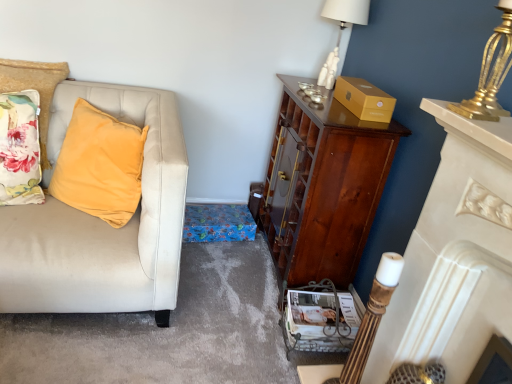
Question: Does gold metallic lamp at upper right, which is counted as the 1th lamp, starting from the front, have a lesser height compared to floral fabric pillow at left?

Choices:
 (A) no
 (B) yes

Answer: (B)

Question: Is floral fabric pillow at left located within gold metallic lamp at upper right, which appears as the 2th lamp when viewed from the top?

Choices:
 (A) yes
 (B) no

Answer: (B)

Question: Is gold metallic lamp at upper right, which is the first lamp in bottom-to-top order, to the left of floral fabric pillow at left from the viewer's perspective?

Choices:
 (A) no
 (B) yes

Answer: (A)

Question: Is gold metallic lamp at upper right, which is counted as the 1th lamp, starting from the right, in front of floral fabric pillow at left?

Choices:
 (A) yes
 (B) no

Answer: (A)

Question: Is gold metallic lamp at upper right, which is the first lamp in bottom-to-top order, wider than floral fabric pillow at left?

Choices:
 (A) no
 (B) yes

Answer: (A)

Question: Looking at their shapes, would you say gold metallic lamp at upper right, placed as the 2th lamp when sorted from left to right, is wider or thinner than white ceramic lamp at upper right, the 2th lamp from the right?

Choices:
 (A) thin
 (B) wide

Answer: (A)

Question: From the image's perspective, is gold metallic lamp at upper right, which is counted as the 1th lamp, starting from the front, located above or below white ceramic lamp at upper right, the second lamp positioned from the bottom?

Choices:
 (A) below
 (B) above

Answer: (A)

Question: Based on their positions, is gold metallic lamp at upper right, which is counted as the 1th lamp, starting from the right, located to the left or right of white ceramic lamp at upper right, which is the 1th lamp from back to front?

Choices:
 (A) right
 (B) left

Answer: (A)

Question: Is gold metallic lamp at upper right, placed as the 2th lamp when sorted from left to right, taller or shorter than white ceramic lamp at upper right, the 2th lamp from the right?

Choices:
 (A) short
 (B) tall

Answer: (A)

Question: From the image's perspective, is white ceramic lamp at upper right, which is the first lamp in left-to-right order, positioned above or below floral fabric pillow at left?

Choices:
 (A) below
 (B) above

Answer: (B)

Question: Is point (345, 4) closer or farther from the camera than point (20, 64)?

Choices:
 (A) farther
 (B) closer

Answer: (A)

Question: Relative to floral fabric pillow at left, is white ceramic lamp at upper right, arranged as the first lamp when viewed from the top, in front or behind?

Choices:
 (A) front
 (B) behind

Answer: (B)

Question: Considering the positions of white ceramic lamp at upper right, which is counted as the second lamp, starting from the front, and floral fabric pillow at left in the image, is white ceramic lamp at upper right, which is counted as the second lamp, starting from the front, wider or thinner than floral fabric pillow at left?

Choices:
 (A) wide
 (B) thin

Answer: (B)

Question: From a real-world perspective, is floral fabric pillow at left physically located above or below matte white magazine at lower center?

Choices:
 (A) above
 (B) below

Answer: (A)

Question: Is point (45, 155) closer or farther from the camera than point (332, 322)?

Choices:
 (A) closer
 (B) farther

Answer: (B)